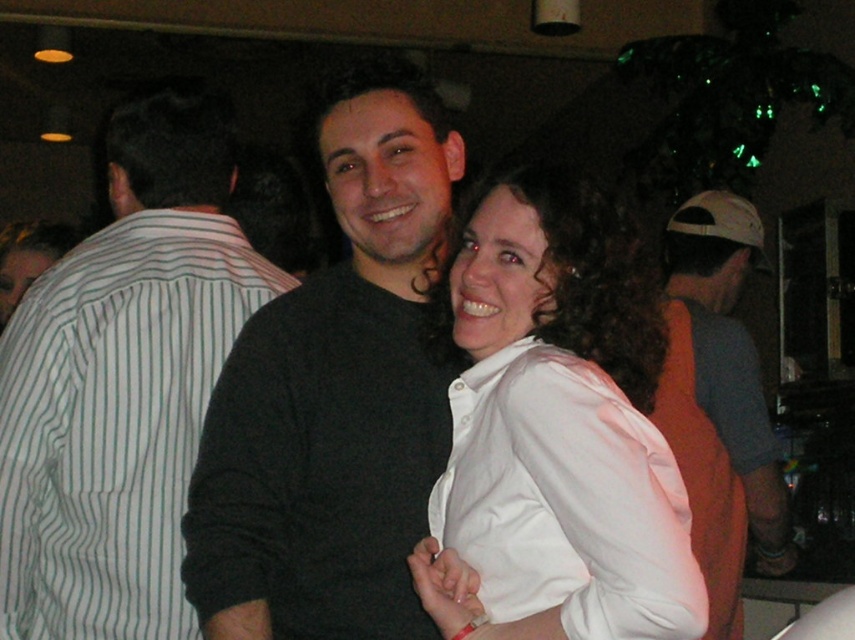
How much distance is there between black matte sweater at center and white striped shirt at left?

black matte sweater at center is 16.42 inches away from white striped shirt at left.

The image size is (855, 640). Identify the location of black matte sweater at center. (335, 396).

Locate an element on the screen. black matte sweater at center is located at coordinates (335, 396).

Does white striped shirt at left come behind white satin blouse at center?

Yes.

Consider the image. Does white striped shirt at left appear on the right side of white satin blouse at center?

No, white striped shirt at left is not to the right of white satin blouse at center.

Who is more distant from viewer, (108, 388) or (500, 182)?

The point (108, 388) is behind.

The width and height of the screenshot is (855, 640). Find the location of `white striped shirt at left`. white striped shirt at left is located at coordinates (122, 384).

Between point (455, 445) and point (739, 618), which one is positioned in front?

Point (455, 445)

Who is higher up, white satin blouse at center or gray cotton shirt at right?

white satin blouse at center is above.

Which is behind, point (502, 634) or point (668, 326)?

Point (668, 326)

Identify the location of white satin blouse at center. (557, 429).